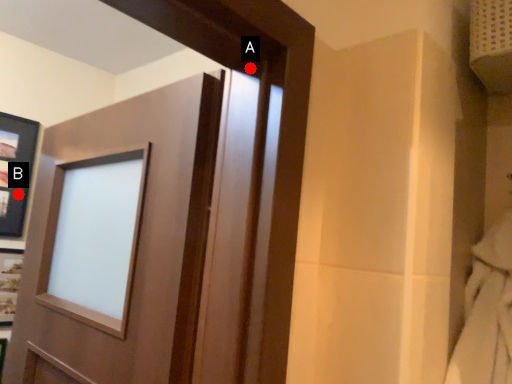
Question: Two points are circled on the image, labeled by A and B beside each circle. Which point appears closest to the camera in this image?

Choices:
 (A) A is closer
 (B) B is closer

Answer: (A)